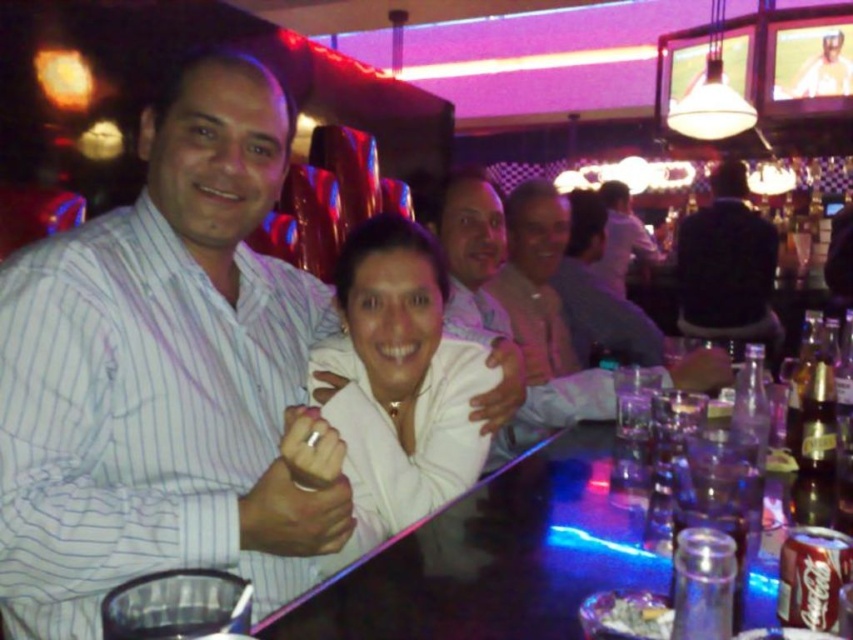
What do you see at coordinates (399, 384) in the screenshot?
I see `white glossy shirt at center` at bounding box center [399, 384].

From the picture: Who is shorter, white glossy shirt at center or clear glass bottle at bar?

Standing shorter between the two is clear glass bottle at bar.

This screenshot has width=853, height=640. Describe the element at coordinates (399, 384) in the screenshot. I see `white glossy shirt at center` at that location.

In order to click on white glossy shirt at center in this screenshot , I will do `click(399, 384)`.

Who is more forward, [48,624] or [746,289]?

Point [48,624] is more forward.

In the scene shown: Does white striped shirt at center come behind black fabric shirt at right?

No, white striped shirt at center is in front of black fabric shirt at right.

Is point (144, 198) closer to viewer compared to point (769, 250)?

Yes, it is in front of point (769, 250).

Where is `white striped shirt at center`? The height and width of the screenshot is (640, 853). white striped shirt at center is located at coordinates (163, 372).

Who is taller, black fabric shirt at right or clear glass bottle at bar?

black fabric shirt at right

Does point (689, 250) lie in front of point (759, 435)?

That is False.

The height and width of the screenshot is (640, 853). Identify the location of black fabric shirt at right. (727, 266).